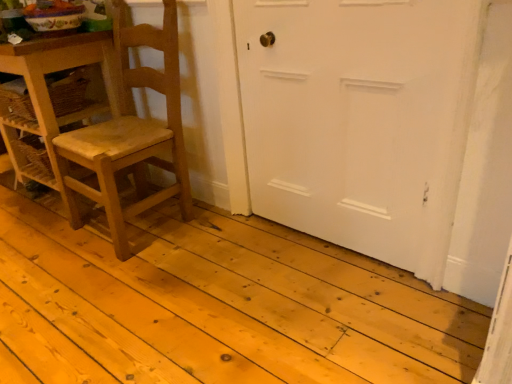
The image size is (512, 384). In order to click on free space to the right of wooden chair at left in this screenshot , I will do `click(216, 237)`.